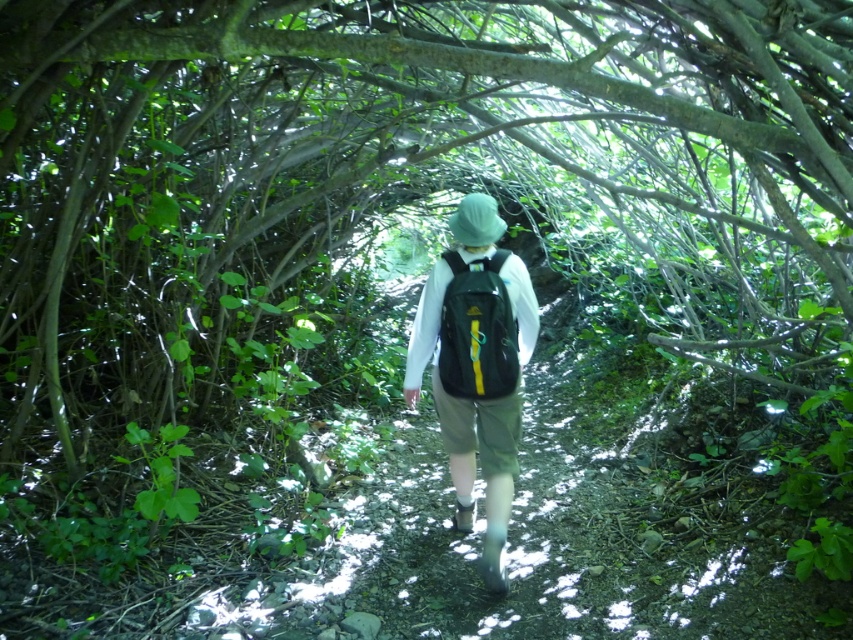
You are a hiker who wants to adjust your backpacks for better balance. You have a matte black backpack at center and a matte green backpack at center. Which backpack should you adjust first if you want to start with the one on the right?

The matte black backpack at center is positioned on the right side of the matte green backpack at center, so you should adjust the matte black backpack at center first.

You are a hiker who wants to ensure your backpack is the tallest one in the scene. Which backpack should you choose between the matte black backpack at center and the matte green backpack at center?

The matte black backpack at center has a greater height compared to the matte green backpack at center, so you should choose the matte black backpack at center to have the tallest one.